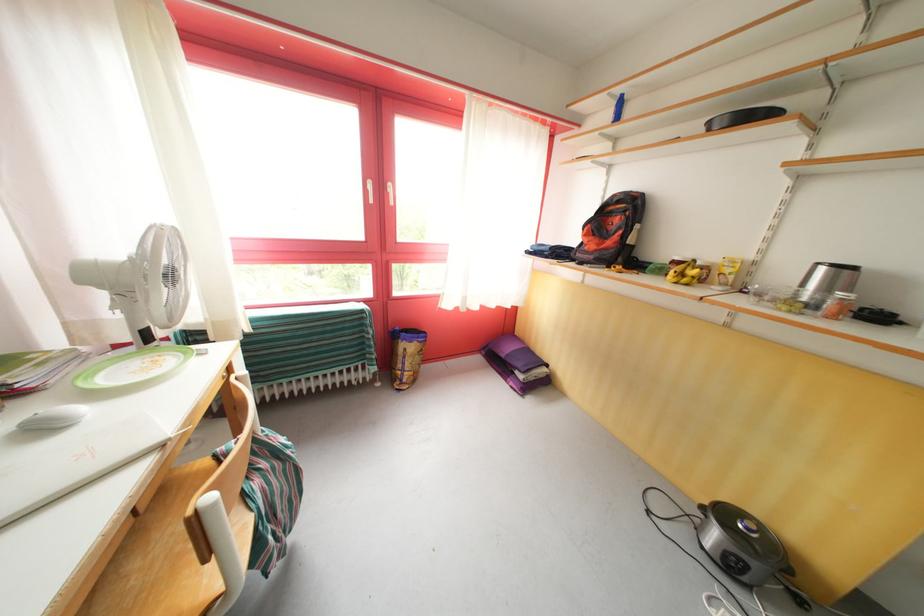
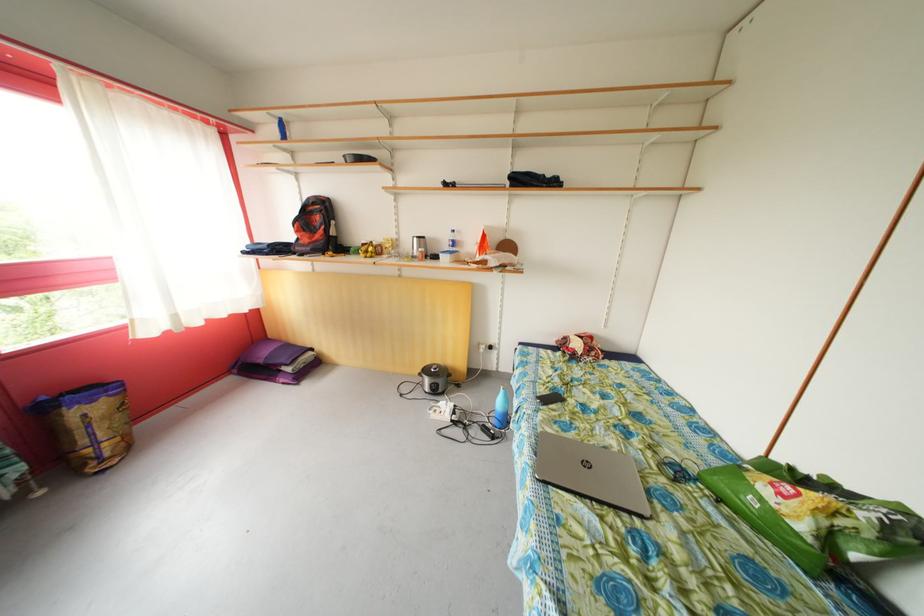
Question: The camera is either moving clockwise (left) or counter-clockwise (right) around the object. The first image is from the beginning of the video and the second image is from the end. Is the camera moving left or right when shooting the video?

Choices:
 (A) Left
 (B) Right

Answer: (A)